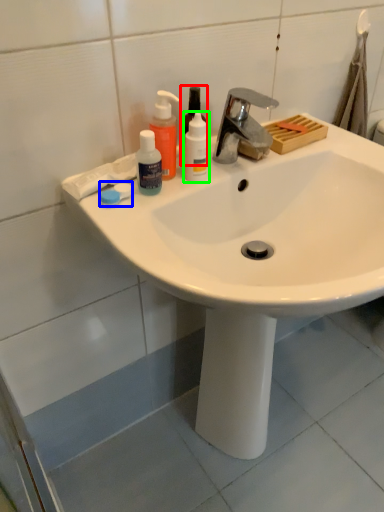
Question: Which object is the farthest from mouthwash (highlighted by a red box)? Choose among these: soap (highlighted by a blue box) or mouthwash (highlighted by a green box).

Choices:
 (A) soap
 (B) mouthwash

Answer: (A)